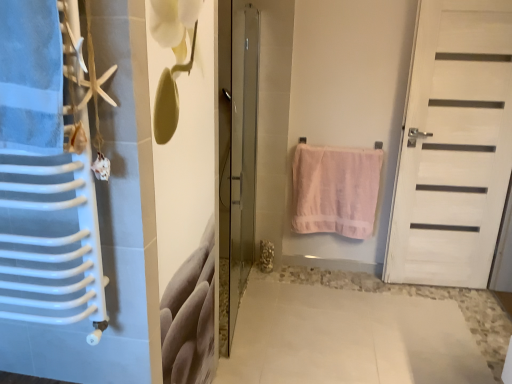
Question: Is white matte door at right, which appears as the 2th door when viewed from the left, bigger than transparent glass door at center, the first door positioned from the left?

Choices:
 (A) yes
 (B) no

Answer: (B)

Question: Does white matte door at right, the 1th door in the right-to-left sequence, turn towards transparent glass door at center, the first door positioned from the left?

Choices:
 (A) yes
 (B) no

Answer: (B)

Question: Is white matte door at right, the 1th door in the right-to-left sequence, taller than transparent glass door at center, marked as the second door in a right-to-left arrangement?

Choices:
 (A) yes
 (B) no

Answer: (A)

Question: Is the depth of white matte door at right, which appears as the 2th door when viewed from the left, less than that of transparent glass door at center, marked as the second door in a right-to-left arrangement?

Choices:
 (A) yes
 (B) no

Answer: (B)

Question: Is white matte door at right, the 1th door in the right-to-left sequence, positioned behind transparent glass door at center, the first door positioned from the left?

Choices:
 (A) no
 (B) yes

Answer: (B)

Question: In terms of height, does transparent glass door at center, the first door positioned from the left, look taller or shorter compared to white matte door at right, the 1th door in the right-to-left sequence?

Choices:
 (A) short
 (B) tall

Answer: (A)

Question: Considering the positions of point pyautogui.click(x=223, y=84) and point pyautogui.click(x=474, y=178), is point pyautogui.click(x=223, y=84) closer or farther from the camera than point pyautogui.click(x=474, y=178)?

Choices:
 (A) closer
 (B) farther

Answer: (A)

Question: From a real-world perspective, is transparent glass door at center, marked as the second door in a right-to-left arrangement, physically located above or below white matte door at right, which appears as the 2th door when viewed from the left?

Choices:
 (A) above
 (B) below

Answer: (B)

Question: In terms of width, does transparent glass door at center, marked as the second door in a right-to-left arrangement, look wider or thinner when compared to white matte door at right, which appears as the 2th door when viewed from the left?

Choices:
 (A) wide
 (B) thin

Answer: (A)

Question: From their relative heights in the image, would you say white matte door at right, which appears as the 2th door when viewed from the left, is taller or shorter than transparent glass door at center, the first door positioned from the left?

Choices:
 (A) short
 (B) tall

Answer: (B)

Question: In terms of width, does white matte door at right, which appears as the 2th door when viewed from the left, look wider or thinner when compared to transparent glass door at center, marked as the second door in a right-to-left arrangement?

Choices:
 (A) wide
 (B) thin

Answer: (B)

Question: Relative to transparent glass door at center, marked as the second door in a right-to-left arrangement, is white matte door at right, which appears as the 2th door when viewed from the left, in front or behind?

Choices:
 (A) front
 (B) behind

Answer: (B)

Question: From a real-world perspective, is white matte door at right, which appears as the 2th door when viewed from the left, above or below transparent glass door at center, marked as the second door in a right-to-left arrangement?

Choices:
 (A) below
 (B) above

Answer: (B)

Question: Considering the positions of point (346, 225) and point (243, 218), is point (346, 225) closer or farther from the camera than point (243, 218)?

Choices:
 (A) farther
 (B) closer

Answer: (B)

Question: From the image's perspective, is pink cotton towel at center located above or below transparent glass door at center, marked as the second door in a right-to-left arrangement?

Choices:
 (A) above
 (B) below

Answer: (B)